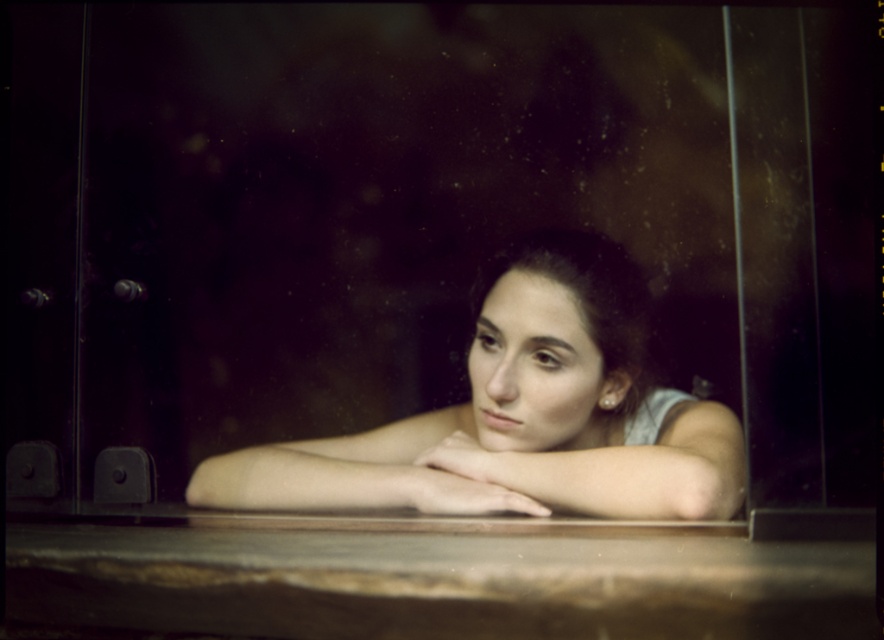
You are an artist trying to draw the scene. You need to ensure the proportions are correct. Which object should you draw wider between the matte skin girl at center and the matte skin arm at center?

The matte skin girl at center should be drawn wider than the matte skin arm at center because the matte skin girl at center has a larger width according to the description.